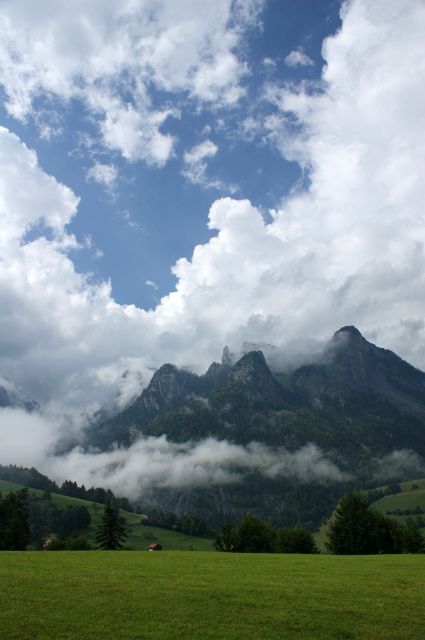
You are a bird soaring in the sky and want to land on the green grassy field at lower center. Can you see the white fluffy cloud at upper center from your landing spot?

A: The white fluffy cloud at upper center has a greater height compared to the green grassy field at lower center. Yes, you can see the white fluffy cloud at upper center from the green grassy field at lower center because it is higher up in the sky.

You are an observer looking at the landscape. You notice the white fluffy cloud at upper center and the green grassy field at lower center. Which object is closer to you?

The white fluffy cloud at upper center is closer to you because the green grassy field at lower center is behind it.

You are standing in the middle of the green grassy field at lower center and looking towards the mountains. Which direction should you walk to reach the white fluffy cloud at upper center?

The white fluffy cloud at upper center is to the left of the green grassy field at lower center, so you should walk to the left to reach it.